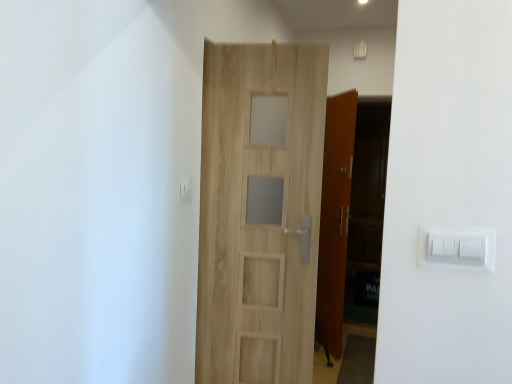
I want to click on white plastic light switch at upper center, acting as the first light switch starting from the left, so click(185, 190).

This screenshot has height=384, width=512. What do you see at coordinates (259, 212) in the screenshot?
I see `light wood door at center` at bounding box center [259, 212].

You are a GUI agent. You are given a task and a screenshot of the screen. Output one action in this format:
    pyautogui.click(x=<x>, y=<y>)
    Task: Click on the white plastic light switch at right, acting as the first light switch starting from the bottom
    
    Given the screenshot: What is the action you would take?
    pyautogui.click(x=457, y=249)

Considering the relative sizes of white plastic light switch at right, marked as the first light switch in a right-to-left arrangement, and white plastic light switch at upper center, which is the second light switch in bottom-to-top order, in the image provided, is white plastic light switch at right, marked as the first light switch in a right-to-left arrangement, taller than white plastic light switch at upper center, which is the second light switch in bottom-to-top order,?

Yes.

From a real-world perspective, between white plastic light switch at right, which appears as the 1th light switch when viewed from the front, and white plastic light switch at upper center, arranged as the 1th light switch when viewed from the top, who is vertically higher?

white plastic light switch at upper center, arranged as the 1th light switch when viewed from the top, is physically above.

Looking at the image, does white plastic light switch at right, arranged as the 2th light switch when viewed from the left, seem bigger or smaller compared to white plastic light switch at upper center, acting as the first light switch starting from the left?

In the image, white plastic light switch at right, arranged as the 2th light switch when viewed from the left, appears to be larger than white plastic light switch at upper center, acting as the first light switch starting from the left.

Which object is closer to the camera taking this photo, white plastic light switch at right, placed as the second light switch when sorted from top to bottom, or white plastic light switch at upper center, positioned as the first light switch in back-to-front order?

white plastic light switch at right, placed as the second light switch when sorted from top to bottom, is in front.

Is white plastic light switch at upper center, positioned as the second light switch in right-to-left order, in front of or behind light wood door at center in the image?

Clearly, white plastic light switch at upper center, positioned as the second light switch in right-to-left order, is in front of light wood door at center.

Looking at this image, can you tell me how much white plastic light switch at upper center, arranged as the 1th light switch when viewed from the top, and light wood door at center differ in facing direction?

80.7 degrees separate the facing orientations of white plastic light switch at upper center, arranged as the 1th light switch when viewed from the top, and light wood door at center.

Which is nearer, (179, 198) or (249, 126)?

The point (179, 198) is closer to the camera.

Which object is thinner, white plastic light switch at upper center, positioned as the first light switch in back-to-front order, or light wood door at center?

With smaller width is white plastic light switch at upper center, positioned as the first light switch in back-to-front order.

How different are the orientations of light wood door at center and white plastic light switch at right, arranged as the 2th light switch when viewed from the left, in degrees?

9.51 degrees separate the facing orientations of light wood door at center and white plastic light switch at right, arranged as the 2th light switch when viewed from the left.

Which object is wider, light wood door at center or white plastic light switch at right, acting as the first light switch starting from the bottom?

Wider between the two is light wood door at center.

In the scene shown: Is light wood door at center behind white plastic light switch at right, acting as the first light switch starting from the bottom?

Yes, light wood door at center is behind white plastic light switch at right, acting as the first light switch starting from the bottom.

Is light wood door at center bigger or smaller than white plastic light switch at right, the 2th light switch positioned from the back?

light wood door at center is bigger than white plastic light switch at right, the 2th light switch positioned from the back.

Between white plastic light switch at right, arranged as the 2th light switch when viewed from the left, and light wood door at center, which one has more height?

Standing taller between the two is light wood door at center.

Is white plastic light switch at right, the 2th light switch positioned from the back, oriented away from light wood door at center?

That's not correct — white plastic light switch at right, the 2th light switch positioned from the back, is not looking away from light wood door at center.

Is white plastic light switch at right, placed as the second light switch when sorted from top to bottom, placed right next to light wood door at center?

No, white plastic light switch at right, placed as the second light switch when sorted from top to bottom, is not making contact with light wood door at center.

Image resolution: width=512 pixels, height=384 pixels. What are the coordinates of `door lying behind the white plastic light switch at right, placed as the second light switch when sorted from top to bottom` in the screenshot? It's located at [x=259, y=212].

Which is more to the right, white plastic light switch at upper center, positioned as the second light switch in right-to-left order, or white plastic light switch at right, placed as the second light switch when sorted from top to bottom?

Positioned to the right is white plastic light switch at right, placed as the second light switch when sorted from top to bottom.

From the image's perspective, does white plastic light switch at upper center, acting as the first light switch starting from the left, appear lower than white plastic light switch at right, arranged as the 2th light switch when viewed from the left?

No, from the image's perspective, white plastic light switch at upper center, acting as the first light switch starting from the left, is not beneath white plastic light switch at right, arranged as the 2th light switch when viewed from the left.

Which is correct: white plastic light switch at upper center, positioned as the second light switch in right-to-left order, is inside white plastic light switch at right, which appears as the 1th light switch when viewed from the front, or outside of it?

The correct answer is: outside.

How different are the orientations of light wood door at center and white plastic light switch at upper center, positioned as the first light switch in back-to-front order, in degrees?

80.7 degrees.

Which is in front, light wood door at center or white plastic light switch at upper center, which is the second light switch in bottom-to-top order?

white plastic light switch at upper center, which is the second light switch in bottom-to-top order.

In the scene shown: From the image's perspective, between light wood door at center and white plastic light switch at upper center, the second light switch when ordered from front to back, which one is located above?

white plastic light switch at upper center, the second light switch when ordered from front to back.

Is light wood door at center facing towards white plastic light switch at upper center, positioned as the second light switch in right-to-left order?

No, light wood door at center does not turn towards white plastic light switch at upper center, positioned as the second light switch in right-to-left order.

The height and width of the screenshot is (384, 512). In order to click on light switch on the right of white plastic light switch at upper center, arranged as the 1th light switch when viewed from the top in this screenshot , I will do `click(457, 249)`.

Where is `the 1st light switch in front of the light wood door at center, counting from the anchor's position`? the 1st light switch in front of the light wood door at center, counting from the anchor's position is located at coordinates (185, 190).

Looking at the image, which one is located further to light wood door at center, white plastic light switch at upper center, the second light switch when ordered from front to back, or white plastic light switch at right, the 2th light switch positioned from the back?

Among the two, white plastic light switch at right, the 2th light switch positioned from the back, is located further to light wood door at center.

Considering their positions, is light wood door at center positioned closer to white plastic light switch at right, arranged as the 2th light switch when viewed from the left, than white plastic light switch at upper center, positioned as the second light switch in right-to-left order?

light wood door at center lies closer to white plastic light switch at right, arranged as the 2th light switch when viewed from the left, than the other object.

Which object lies nearer to the anchor point white plastic light switch at right, marked as the first light switch in a right-to-left arrangement, white plastic light switch at upper center, acting as the first light switch starting from the left, or light wood door at center?

light wood door at center is closer to white plastic light switch at right, marked as the first light switch in a right-to-left arrangement.

Which object lies nearer to the anchor point white plastic light switch at upper center, acting as the first light switch starting from the left, white plastic light switch at right, acting as the first light switch starting from the bottom, or light wood door at center?

light wood door at center is closer to white plastic light switch at upper center, acting as the first light switch starting from the left.

Considering their positions, is white plastic light switch at right, the 2th light switch positioned from the back, positioned closer to light wood door at center than white plastic light switch at upper center, acting as the first light switch starting from the left?

white plastic light switch at upper center, acting as the first light switch starting from the left, lies closer to light wood door at center than the other object.

Considering their positions, is light wood door at center positioned closer to white plastic light switch at upper center, positioned as the first light switch in back-to-front order, than white plastic light switch at right, placed as the second light switch when sorted from top to bottom?

light wood door at center is closer to white plastic light switch at upper center, positioned as the first light switch in back-to-front order.

Where is `door located between white plastic light switch at upper center, positioned as the second light switch in right-to-left order, and white plastic light switch at right, arranged as the 2th light switch when viewed from the left, in the left-right direction`? The width and height of the screenshot is (512, 384). door located between white plastic light switch at upper center, positioned as the second light switch in right-to-left order, and white plastic light switch at right, arranged as the 2th light switch when viewed from the left, in the left-right direction is located at coordinates (259, 212).